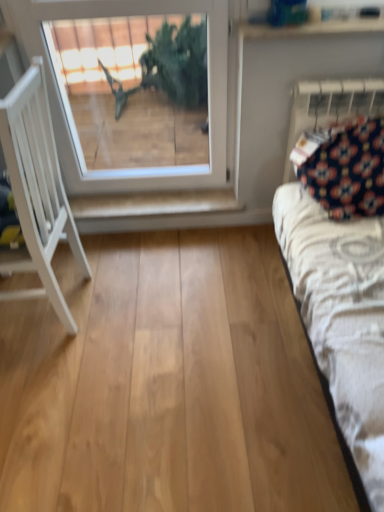
Question: From the image's perspective, is white painted wood shelf at center on top of dark blue fabric at upper right?

Choices:
 (A) yes
 (B) no

Answer: (B)

Question: From a real-world perspective, is white painted wood shelf at center over dark blue fabric at upper right?

Choices:
 (A) yes
 (B) no

Answer: (B)

Question: Is white painted wood shelf at center thinner than dark blue fabric at upper right?

Choices:
 (A) yes
 (B) no

Answer: (B)

Question: Is white painted wood shelf at center in contact with dark blue fabric at upper right?

Choices:
 (A) yes
 (B) no

Answer: (B)

Question: Is white painted wood shelf at center wider than dark blue fabric at upper right?

Choices:
 (A) no
 (B) yes

Answer: (B)

Question: From the image's perspective, relative to white glass window at upper center, is white wood chair at left above or below?

Choices:
 (A) below
 (B) above

Answer: (A)

Question: Is point (89, 273) positioned closer to the camera than point (157, 120)?

Choices:
 (A) closer
 (B) farther

Answer: (A)

Question: Looking at their shapes, would you say white wood chair at left is wider or thinner than white glass window at upper center?

Choices:
 (A) thin
 (B) wide

Answer: (B)

Question: Is white wood chair at left bigger or smaller than white glass window at upper center?

Choices:
 (A) big
 (B) small

Answer: (A)

Question: Is white painted wood shelf at center taller or shorter than white glass window at upper center?

Choices:
 (A) short
 (B) tall

Answer: (A)

Question: Looking at their shapes, would you say white painted wood shelf at center is wider or thinner than white glass window at upper center?

Choices:
 (A) thin
 (B) wide

Answer: (B)

Question: Based on their positions, is white painted wood shelf at center located to the left or right of white glass window at upper center?

Choices:
 (A) left
 (B) right

Answer: (B)

Question: From the image's perspective, is white painted wood shelf at center above or below white glass window at upper center?

Choices:
 (A) above
 (B) below

Answer: (B)

Question: In the image, is white wood chair at left on the left side or the right side of dark blue fabric at upper right?

Choices:
 (A) right
 (B) left

Answer: (B)

Question: Considering the positions of white wood chair at left and dark blue fabric at upper right in the image, is white wood chair at left bigger or smaller than dark blue fabric at upper right?

Choices:
 (A) big
 (B) small

Answer: (A)